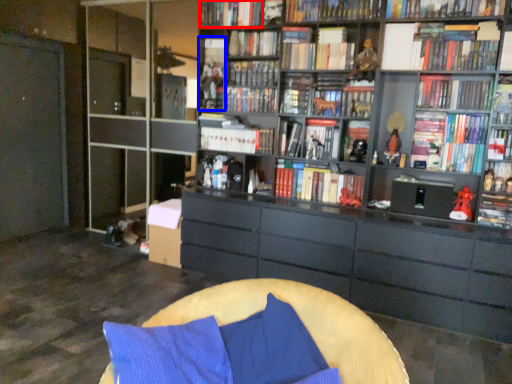
Question: Among these objects, which one is nearest to the camera, book (highlighted by a red box) or book (highlighted by a blue box)?

Choices:
 (A) book
 (B) book

Answer: (A)